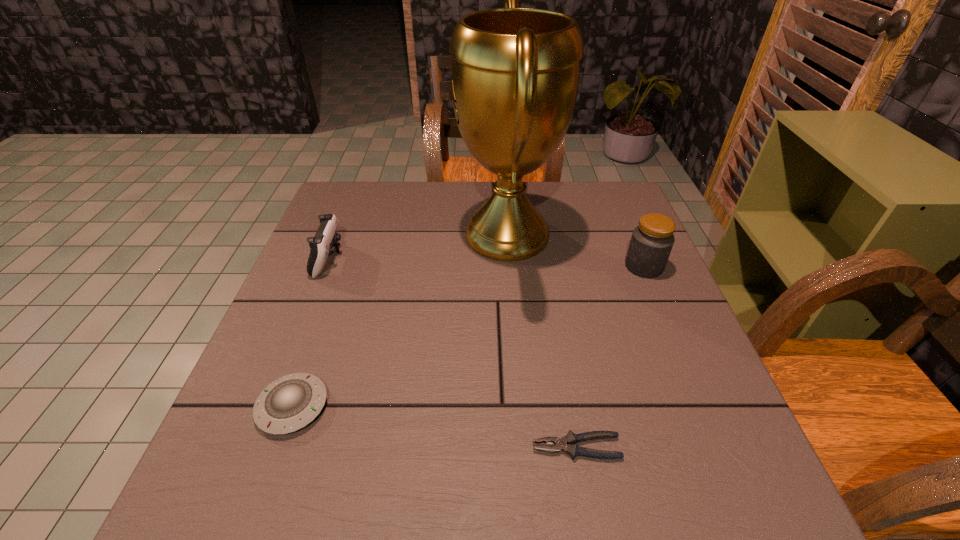
Identify the location of trophy cup. (515, 72).

The height and width of the screenshot is (540, 960). In order to click on jar in this screenshot , I will do `click(651, 243)`.

At what (x,y) coordinates should I click in order to perform the action: click on the rightmost object. Please return your answer as a coordinate pair (x, y). The image size is (960, 540). Looking at the image, I should click on (651, 243).

In order to click on the third shortest object in this screenshot , I will do `click(321, 245)`.

The width and height of the screenshot is (960, 540). What are the coordinates of `saucer` in the screenshot? It's located at (291, 402).

Identify the location of pliers. (568, 444).

Where is `blank space located on the surface of the tallest object with symbols`? blank space located on the surface of the tallest object with symbols is located at coordinates tap(406, 234).

Identify the location of vacant area situated 0.200m on the surface of the tallest object with symbols. (384, 234).

I want to click on vacant space located on the surface of the tallest object with symbols, so click(x=427, y=234).

Where is `vacant space located 0.240m on the surface of the fourth shortest object near the warning symbol`? vacant space located 0.240m on the surface of the fourth shortest object near the warning symbol is located at coordinates (529, 266).